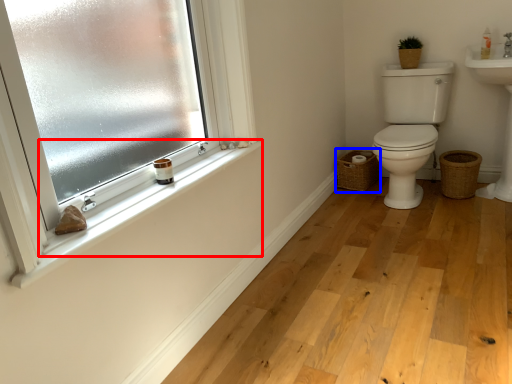
Question: Which of the following is the farthest to the observer, window sill (highlighted by a red box) or basket (highlighted by a blue box)?

Choices:
 (A) window sill
 (B) basket

Answer: (B)